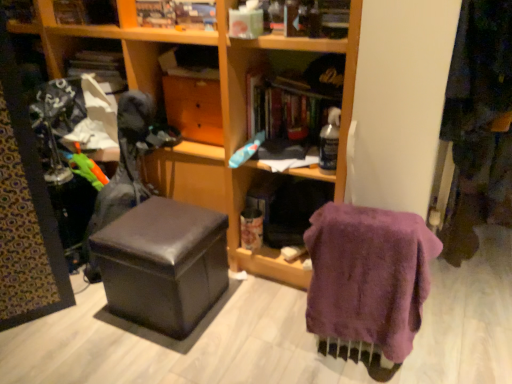
This screenshot has height=384, width=512. What do you see at coordinates (21, 15) in the screenshot?
I see `wooden bookshelf at upper center` at bounding box center [21, 15].

Measure the distance between wooden bookshelf at upper center and camera.

wooden bookshelf at upper center is 1.99 meters away from camera.

Measure the distance between matte cardboard book at upper center, the 3th book in the left-to-right sequence, and camera.

matte cardboard book at upper center, the 3th book in the left-to-right sequence, is 1.84 meters from camera.

Find the location of a particular element. purple fuzzy towel at lower right is located at coordinates (369, 275).

The height and width of the screenshot is (384, 512). Describe the element at coordinates (127, 167) in the screenshot. I see `matte black swivel chair at center` at that location.

Locate an element on the screen. The height and width of the screenshot is (384, 512). matte black ottoman at center is located at coordinates (222, 113).

Identify the location of matte black stool at center. (163, 264).

What is the approximate width of matte black stool at center?

matte black stool at center is 17.53 inches wide.

The height and width of the screenshot is (384, 512). Identify the location of wooden bookshelf at upper center. (21, 15).

How much distance is there between wooden bookshelf at upper center and wooden book at upper center, the second book in the left-to-right sequence?

wooden bookshelf at upper center and wooden book at upper center, the second book in the left-to-right sequence, are 28.86 inches apart.

Which of these two, wooden bookshelf at upper center or wooden book at upper center, the second book in the left-to-right sequence, is bigger?

Bigger between the two is wooden book at upper center, the second book in the left-to-right sequence.

Does wooden bookshelf at upper center appear on the right side of wooden book at upper center, the 3th book viewed from the right?

No, wooden bookshelf at upper center is not to the right of wooden book at upper center, the 3th book viewed from the right.

Between wooden bookshelf at upper center and wooden book at upper center, the 3th book viewed from the right, which one has more height?

Standing taller between the two is wooden book at upper center, the 3th book viewed from the right.

From the image's perspective, which one is positioned lower, matte black stool at center or matte black ottoman at center?

matte black stool at center is shown below in the image.

Identify the location of stool located on the right of matte black ottoman at center. The height and width of the screenshot is (384, 512). (163, 264).

Can you confirm if matte black stool at center is taller than matte black ottoman at center?

No, matte black stool at center is not taller than matte black ottoman at center.

Considering the points (169, 324) and (242, 170), which point is in front, point (169, 324) or point (242, 170)?

The point (169, 324) is closer to the camera.

Is matte cardboard book at upper center, the 4th book viewed from the right, closer to camera compared to matte black ottoman at center?

No.

Can we say matte cardboard book at upper center, arranged as the 1th book when viewed from the left, lies outside matte black ottoman at center?

No, matte cardboard book at upper center, arranged as the 1th book when viewed from the left, is not outside of matte black ottoman at center.

Can you tell me how much matte cardboard book at upper center, the 4th book viewed from the right, and matte black ottoman at center differ in facing direction?

They differ by 0.328 degrees in their facing directions.

Which object is positioned more to the right, matte cardboard book at upper center, arranged as the 1th book when viewed from the left, or matte black ottoman at center?

From the viewer's perspective, matte black ottoman at center appears more on the right side.

Between point (169, 79) and point (150, 22), which one is positioned behind?

The point (169, 79) is farther from the camera.

Considering the positions of objects wooden drawer at center and wooden book at upper center, the 3th book viewed from the right, in the image provided, who is more to the right, wooden drawer at center or wooden book at upper center, the 3th book viewed from the right,?

wooden drawer at center is more to the right.

Considering the sizes of wooden drawer at center and wooden book at upper center, the second book in the left-to-right sequence, in the image, is wooden drawer at center bigger or smaller than wooden book at upper center, the second book in the left-to-right sequence,?

Clearly, wooden drawer at center is larger in size than wooden book at upper center, the second book in the left-to-right sequence.

From a real-world perspective, relative to wooden book at upper center, the 3th book viewed from the right, is wooden drawer at center vertically above or below?

wooden drawer at center is below wooden book at upper center, the 3th book viewed from the right.

Based on the photo, from the image's perspective, is wooden book at upper center, the 3th book viewed from the right, over hardcover book at center, acting as the first book starting from the right?

Correct, wooden book at upper center, the 3th book viewed from the right, appears higher than hardcover book at center, acting as the first book starting from the right, in the image.

Considering the relative sizes of wooden book at upper center, the 3th book viewed from the right, and hardcover book at center, the fourth book in the left-to-right sequence, in the image provided, is wooden book at upper center, the 3th book viewed from the right, wider than hardcover book at center, the fourth book in the left-to-right sequence,?

No.

From the hardcover book at center, the fourth book in the left-to-right sequence, count the 2nd book to the left and point to it. Please provide its 2D coordinates.

[(177, 14)]

Is point (347, 99) behind point (271, 95)?

No, it is in front of (271, 95).

Can we say matte black ottoman at center lies outside hardcover book at center, acting as the first book starting from the right?

matte black ottoman at center lies outside hardcover book at center, acting as the first book starting from the right,'s area.

Who is bigger, matte black ottoman at center or hardcover book at center, acting as the first book starting from the right?

Bigger between the two is matte black ottoman at center.

Locate an element on the screen. The height and width of the screenshot is (384, 512). furniture below the wooden drawer at center (from the image's perspective) is located at coordinates [x=222, y=113].

From the picture: Does wooden drawer at center have a larger size compared to matte black ottoman at center?

No, wooden drawer at center is not bigger than matte black ottoman at center.

How many degrees apart are the facing directions of wooden drawer at center and matte black ottoman at center?

The facing directions of wooden drawer at center and matte black ottoman at center are 0.000407 degrees apart.

Is matte black ottoman at center surrounded by wooden drawer at center?

Actually, matte black ottoman at center is outside wooden drawer at center.

The height and width of the screenshot is (384, 512). I want to click on shelf above the wooden book at upper center, the 3th book viewed from the right (from the image's perspective), so click(x=21, y=15).

What are the coordinates of `stool below the matte black ottoman at center (from the image's perspective)` in the screenshot? It's located at (163, 264).

Looking at the image, which one is located closer to purple fuzzy towel at lower right, matte black ottoman at center or wooden drawer at center?

matte black ottoman at center lies closer to purple fuzzy towel at lower right than the other object.

Looking at this image, looking at the image, which one is located further to wooden bookshelf at upper center, wooden drawer at center or wooden book at upper center, the second book in the left-to-right sequence?

wooden drawer at center is positioned further to the anchor wooden bookshelf at upper center.

Considering their positions, is wooden book at upper center, the second book in the left-to-right sequence, positioned further to wooden drawer at center than matte black stool at center?

matte black stool at center.

Based on their spatial positions, is matte black stool at center or wooden bookshelf at upper center closer to wooden book at upper center, the second book in the left-to-right sequence?

Among the two, wooden bookshelf at upper center is located nearer to wooden book at upper center, the second book in the left-to-right sequence.

When comparing their distances from matte black stool at center, does matte black swivel chair at center or matte cardboard book at upper center, the 3th book in the left-to-right sequence, seem further?

Among the two, matte cardboard book at upper center, the 3th book in the left-to-right sequence, is located further to matte black stool at center.

Estimate the real-world distances between objects in this image. Which object is further from matte black swivel chair at center, matte cardboard book at upper center, arranged as the 1th book when viewed from the left, or matte cardboard book at upper center, which is the 2th book from right to left?

Based on the image, matte cardboard book at upper center, arranged as the 1th book when viewed from the left, appears to be further to matte black swivel chair at center.

Based on their spatial positions, is hardcover book at center, acting as the first book starting from the right, or wooden bookshelf at upper center further from wooden book at upper center, the 3th book viewed from the right?

The object further to wooden book at upper center, the 3th book viewed from the right, is wooden bookshelf at upper center.

From the image, which object appears to be farther from matte black swivel chair at center, wooden drawer at center or wooden bookshelf at upper center?

Based on the image, wooden bookshelf at upper center appears to be further to matte black swivel chair at center.

You are a GUI agent. You are given a task and a screenshot of the screen. Output one action in this format:
    pyautogui.click(x=<x>, y=<y>)
    Task: Click on the furniture between matte cardboard book at upper center, arranged as the 1th book when viewed from the left, and matte cardboard book at upper center, the 3th book in the left-to-right sequence
    The height and width of the screenshot is (384, 512).
    Given the screenshot: What is the action you would take?
    pyautogui.click(x=222, y=113)

I want to click on furniture that lies between wooden book at upper center, the second book in the left-to-right sequence, and matte black stool at center from top to bottom, so click(222, 113).

You are a GUI agent. You are given a task and a screenshot of the screen. Output one action in this format:
    pyautogui.click(x=<x>, y=<y>)
    Task: Click on the stool between matte black swivel chair at center and hardcover book at center, the fourth book in the left-to-right sequence
    
    Given the screenshot: What is the action you would take?
    pyautogui.click(x=163, y=264)

The height and width of the screenshot is (384, 512). I want to click on furniture between matte cardboard book at upper center, the 4th book viewed from the right, and matte black stool at center from top to bottom, so click(222, 113).